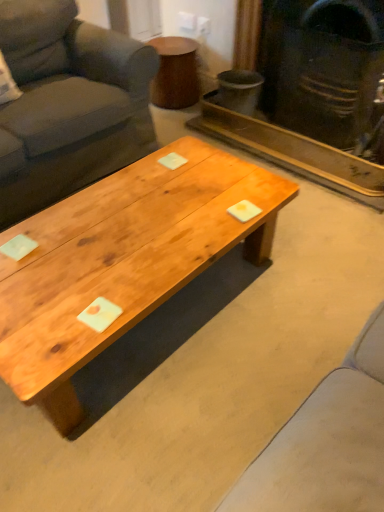
Where is `free point to the right of natural wood coffee table at center`? This screenshot has width=384, height=512. free point to the right of natural wood coffee table at center is located at coordinates click(297, 293).